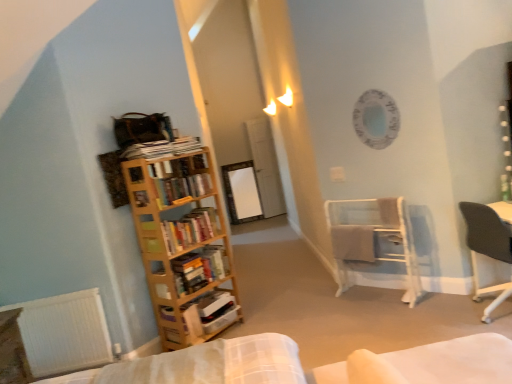
Question: Is wooden table at lower left positioned beyond the bounds of wooden bookshelf at left, the 3th book when ordered from top to bottom?

Choices:
 (A) no
 (B) yes

Answer: (B)

Question: Is wooden table at lower left wider than wooden bookshelf at left, the 3th book when ordered from top to bottom?

Choices:
 (A) no
 (B) yes

Answer: (B)

Question: Does wooden table at lower left have a smaller size compared to wooden bookshelf at left, placed as the 2th book when sorted from bottom to top?

Choices:
 (A) no
 (B) yes

Answer: (A)

Question: Is wooden table at lower left thinner than wooden bookshelf at left, placed as the 2th book when sorted from bottom to top?

Choices:
 (A) no
 (B) yes

Answer: (A)

Question: Is the position of wooden table at lower left more distant than that of wooden bookshelf at left, placed as the 2th book when sorted from bottom to top?

Choices:
 (A) yes
 (B) no

Answer: (B)

Question: From their relative heights in the image, would you say white matte radiator at lower left is taller or shorter than hardcover books at left, which is the second book in top-to-bottom order?

Choices:
 (A) short
 (B) tall

Answer: (B)

Question: Is white matte radiator at lower left spatially inside hardcover books at left, the 3th book positioned from the bottom, or outside of it?

Choices:
 (A) outside
 (B) inside

Answer: (A)

Question: From a real-world perspective, relative to hardcover books at left, which is the second book in top-to-bottom order, is white matte radiator at lower left vertically above or below?

Choices:
 (A) above
 (B) below

Answer: (B)

Question: Based on their positions, is white matte radiator at lower left located to the left or right of hardcover books at left, which is the second book in top-to-bottom order?

Choices:
 (A) right
 (B) left

Answer: (B)

Question: Considering the positions of wooden bookcase at left and transparent glass door at center in the image, is wooden bookcase at left wider or thinner than transparent glass door at center?

Choices:
 (A) wide
 (B) thin

Answer: (A)

Question: From a real-world perspective, is wooden bookcase at left above or below transparent glass door at center?

Choices:
 (A) above
 (B) below

Answer: (B)

Question: Considering the positions of point (202, 208) and point (269, 157), is point (202, 208) closer or farther from the camera than point (269, 157)?

Choices:
 (A) closer
 (B) farther

Answer: (A)

Question: Based on their sizes in the image, would you say wooden bookcase at left is bigger or smaller than transparent glass door at center?

Choices:
 (A) small
 (B) big

Answer: (B)

Question: Is white cardboard box at left, the fourth book in the top-to-bottom sequence, taller or shorter than wooden bookcase at left?

Choices:
 (A) tall
 (B) short

Answer: (B)

Question: In the image, is white cardboard box at left, which is the 1th book in bottom-to-top order, positioned in front of or behind wooden bookcase at left?

Choices:
 (A) behind
 (B) front

Answer: (A)